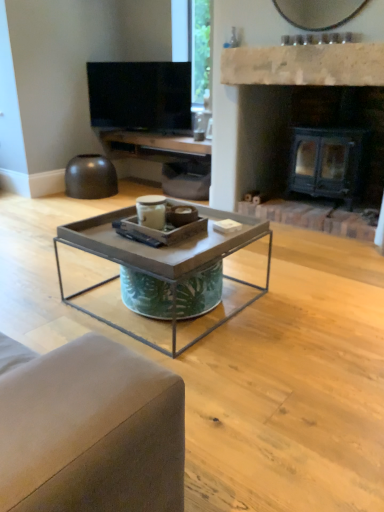
Question: Does flat screen tv at upper center come behind matte wood entertainment center at upper center?

Choices:
 (A) yes
 (B) no

Answer: (A)

Question: Is flat screen tv at upper center facing towards matte wood entertainment center at upper center?

Choices:
 (A) yes
 (B) no

Answer: (B)

Question: From a real-world perspective, is flat screen tv at upper center on matte wood entertainment center at upper center?

Choices:
 (A) no
 (B) yes

Answer: (B)

Question: Does flat screen tv at upper center have a greater height compared to matte wood entertainment center at upper center?

Choices:
 (A) yes
 (B) no

Answer: (A)

Question: Does flat screen tv at upper center have a larger size compared to matte wood entertainment center at upper center?

Choices:
 (A) no
 (B) yes

Answer: (A)

Question: Would you say flat screen tv at upper center contains matte wood entertainment center at upper center?

Choices:
 (A) yes
 (B) no

Answer: (B)

Question: Is black metal fireplace at center behind flat screen tv at upper center?

Choices:
 (A) no
 (B) yes

Answer: (A)

Question: Is black metal fireplace at center at the left side of flat screen tv at upper center?

Choices:
 (A) yes
 (B) no

Answer: (B)

Question: Is black metal fireplace at center bigger than flat screen tv at upper center?

Choices:
 (A) no
 (B) yes

Answer: (B)

Question: Considering the relative positions of black metal fireplace at center and flat screen tv at upper center in the image provided, is black metal fireplace at center to the right of flat screen tv at upper center from the viewer's perspective?

Choices:
 (A) no
 (B) yes

Answer: (B)

Question: From a real-world perspective, is black metal fireplace at center physically below flat screen tv at upper center?

Choices:
 (A) yes
 (B) no

Answer: (A)

Question: From the image's perspective, is black metal fireplace at center on top of flat screen tv at upper center?

Choices:
 (A) yes
 (B) no

Answer: (B)

Question: Is metal/texturedcoffee table at center beside white stone fireplace at upper center?

Choices:
 (A) no
 (B) yes

Answer: (A)